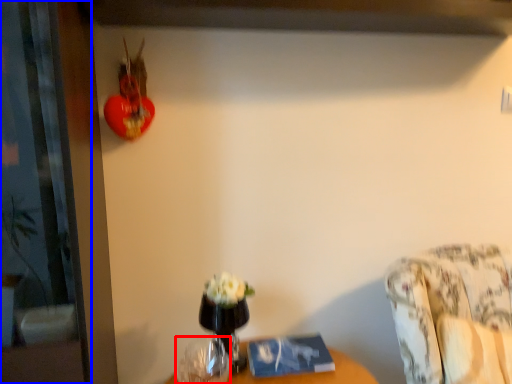
Question: Which of the following is the closest to the observer, vase (highlighted by a red box) or screen door (highlighted by a blue box)?

Choices:
 (A) vase
 (B) screen door

Answer: (B)